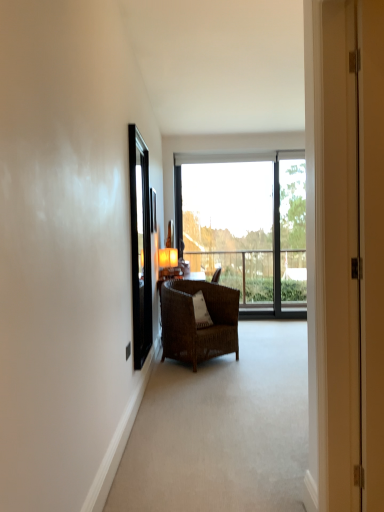
Image resolution: width=384 pixels, height=512 pixels. I want to click on free space on the front side of brown wicker chair at center, so click(217, 374).